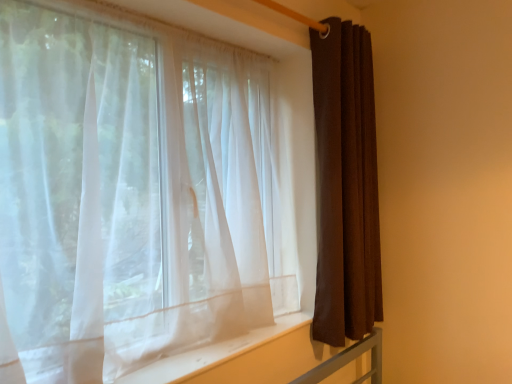
Where is `sheer white curtain at left, which is counted as the 1th curtain, starting from the left`? This screenshot has width=512, height=384. sheer white curtain at left, which is counted as the 1th curtain, starting from the left is located at coordinates (130, 195).

What is the approximate width of white sheer fabric at lower center?

white sheer fabric at lower center is 10.17 inches in width.

At what (x,y) coordinates should I click in order to perform the action: click on sheer white curtain at left, which is counted as the 1th curtain, starting from the left. Please return your answer as a coordinate pair (x, y). Looking at the image, I should click on (130, 195).

Is white sheer fabric at lower center located within sheer white curtain at left, which is counted as the 1th curtain, starting from the left?

That's incorrect, white sheer fabric at lower center is not inside sheer white curtain at left, which is counted as the 1th curtain, starting from the left.

Is sheer white curtain at left, which is counted as the 1th curtain, starting from the left, further to the viewer compared to white sheer fabric at lower center?

No, the depth of sheer white curtain at left, which is counted as the 1th curtain, starting from the left, is less than that of white sheer fabric at lower center.

Considering the positions of point (179, 311) and point (190, 359), is point (179, 311) closer or farther from the camera than point (190, 359)?

Point (179, 311).

Can you tell me how much sheer white curtain at left, which is counted as the 1th curtain, starting from the left, and white sheer fabric at lower center differ in facing direction?

0.358 degrees.

From the image's perspective, is brown fabric curtain at right, which is the 2th curtain from left to right, below sheer white curtain at left, which is counted as the 1th curtain, starting from the left?

Actually, brown fabric curtain at right, which is the 2th curtain from left to right, appears above sheer white curtain at left, which is counted as the 1th curtain, starting from the left, in the image.

Consider the image. From a real-world perspective, does brown fabric curtain at right, which is the 2th curtain from left to right, sit lower than sheer white curtain at left, which is counted as the 1th curtain, starting from the left?

Actually, brown fabric curtain at right, which is the 2th curtain from left to right, is physically above sheer white curtain at left, which is counted as the 1th curtain, starting from the left, in the real world.

Could you tell me if brown fabric curtain at right, marked as the 1th curtain in a right-to-left arrangement, is turned towards sheer white curtain at left, which ranks as the second curtain in right-to-left order?

No.

From the image's perspective, is white sheer fabric at lower center under sheer white curtain at left, which is counted as the 1th curtain, starting from the left?

Yes, from the image's perspective, white sheer fabric at lower center is below sheer white curtain at left, which is counted as the 1th curtain, starting from the left.

From a real-world perspective, who is located lower, white sheer fabric at lower center or sheer white curtain at left, which ranks as the second curtain in right-to-left order?

In real-world perspective, white sheer fabric at lower center is lower.

Is white sheer fabric at lower center facing towards sheer white curtain at left, which ranks as the second curtain in right-to-left order?

No.

Considering the relative sizes of sheer white curtain at left, which ranks as the second curtain in right-to-left order, and brown fabric curtain at right, which is the 2th curtain from left to right, in the image provided, is sheer white curtain at left, which ranks as the second curtain in right-to-left order, smaller than brown fabric curtain at right, which is the 2th curtain from left to right,?

Actually, sheer white curtain at left, which ranks as the second curtain in right-to-left order, might be larger than brown fabric curtain at right, which is the 2th curtain from left to right.

Between point (130, 252) and point (361, 198), which one is positioned behind?

The point (361, 198) is behind.

From a real-world perspective, is sheer white curtain at left, which ranks as the second curtain in right-to-left order, above or below brown fabric curtain at right, marked as the 1th curtain in a right-to-left arrangement?

In terms of real-world spatial position, sheer white curtain at left, which ranks as the second curtain in right-to-left order, is below brown fabric curtain at right, marked as the 1th curtain in a right-to-left arrangement.

Is brown fabric curtain at right, marked as the 1th curtain in a right-to-left arrangement, next to white sheer fabric at lower center and touching it?

No, brown fabric curtain at right, marked as the 1th curtain in a right-to-left arrangement, is not making contact with white sheer fabric at lower center.

Is brown fabric curtain at right, marked as the 1th curtain in a right-to-left arrangement, looking in the opposite direction of white sheer fabric at lower center?

No, brown fabric curtain at right, marked as the 1th curtain in a right-to-left arrangement,'s orientation is not away from white sheer fabric at lower center.

Which of these two, brown fabric curtain at right, marked as the 1th curtain in a right-to-left arrangement, or white sheer fabric at lower center, stands shorter?

white sheer fabric at lower center.

From the image's perspective, between brown fabric curtain at right, which is the 2th curtain from left to right, and white sheer fabric at lower center, which one is located above?

From the image's view, brown fabric curtain at right, which is the 2th curtain from left to right, is above.

In the scene shown: Is white sheer fabric at lower center bigger or smaller than brown fabric curtain at right, which is the 2th curtain from left to right?

white sheer fabric at lower center is smaller than brown fabric curtain at right, which is the 2th curtain from left to right.

Which is behind, point (211, 354) or point (356, 252)?

Positioned behind is point (356, 252).

Are white sheer fabric at lower center and brown fabric curtain at right, marked as the 1th curtain in a right-to-left arrangement, making contact?

There is a gap between white sheer fabric at lower center and brown fabric curtain at right, marked as the 1th curtain in a right-to-left arrangement.

Is white sheer fabric at lower center looking in the opposite direction of brown fabric curtain at right, marked as the 1th curtain in a right-to-left arrangement?

No, white sheer fabric at lower center is not facing away from brown fabric curtain at right, marked as the 1th curtain in a right-to-left arrangement.

The width and height of the screenshot is (512, 384). I want to click on window sill located behind the sheer white curtain at left, which ranks as the second curtain in right-to-left order, so click(213, 353).

Locate an element on the screen. This screenshot has width=512, height=384. curtain in front of the brown fabric curtain at right, which is the 2th curtain from left to right is located at coordinates (130, 195).

Considering their positions, is brown fabric curtain at right, marked as the 1th curtain in a right-to-left arrangement, positioned further to sheer white curtain at left, which is counted as the 1th curtain, starting from the left, than white sheer fabric at lower center?

brown fabric curtain at right, marked as the 1th curtain in a right-to-left arrangement.

Estimate the real-world distances between objects in this image. Which object is further from brown fabric curtain at right, marked as the 1th curtain in a right-to-left arrangement, white sheer fabric at lower center or sheer white curtain at left, which ranks as the second curtain in right-to-left order?

white sheer fabric at lower center lies further to brown fabric curtain at right, marked as the 1th curtain in a right-to-left arrangement, than the other object.

Considering their positions, is white sheer fabric at lower center positioned closer to sheer white curtain at left, which ranks as the second curtain in right-to-left order, than brown fabric curtain at right, marked as the 1th curtain in a right-to-left arrangement?

white sheer fabric at lower center.

In the scene shown: Looking at the image, which one is located further to brown fabric curtain at right, which is the 2th curtain from left to right, sheer white curtain at left, which ranks as the second curtain in right-to-left order, or white sheer fabric at lower center?

white sheer fabric at lower center is further to brown fabric curtain at right, which is the 2th curtain from left to right.

Considering their positions, is brown fabric curtain at right, marked as the 1th curtain in a right-to-left arrangement, positioned further to white sheer fabric at lower center than sheer white curtain at left, which ranks as the second curtain in right-to-left order?

brown fabric curtain at right, marked as the 1th curtain in a right-to-left arrangement, is further to white sheer fabric at lower center.

Consider the image. Based on their spatial positions, is sheer white curtain at left, which ranks as the second curtain in right-to-left order, or brown fabric curtain at right, which is the 2th curtain from left to right, further from white sheer fabric at lower center?

brown fabric curtain at right, which is the 2th curtain from left to right.

Identify the location of window sill between sheer white curtain at left, which ranks as the second curtain in right-to-left order, and brown fabric curtain at right, marked as the 1th curtain in a right-to-left arrangement, from front to back. This screenshot has height=384, width=512. (213, 353).